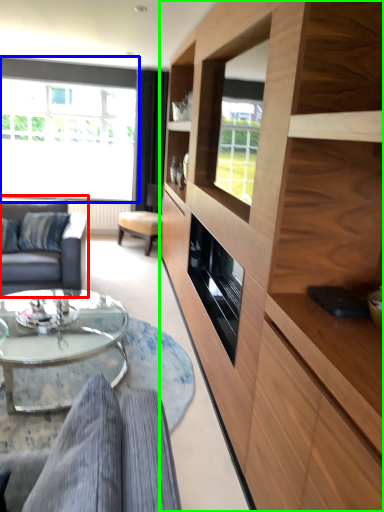
Question: Which object is positioned closest to studio couch (highlighted by a red box)? Select from window (highlighted by a blue box) and cabinetry (highlighted by a green box).

Choices:
 (A) window
 (B) cabinetry

Answer: (B)